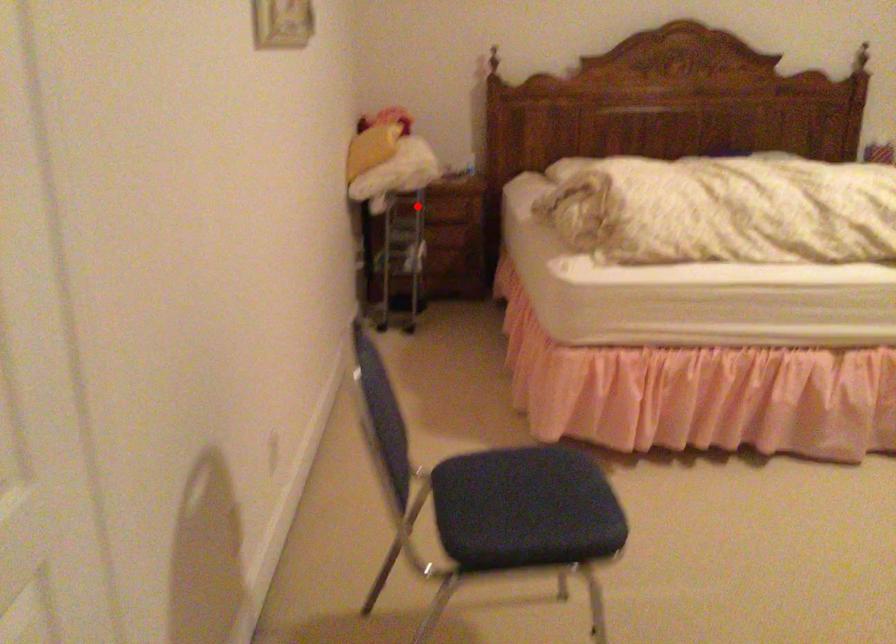
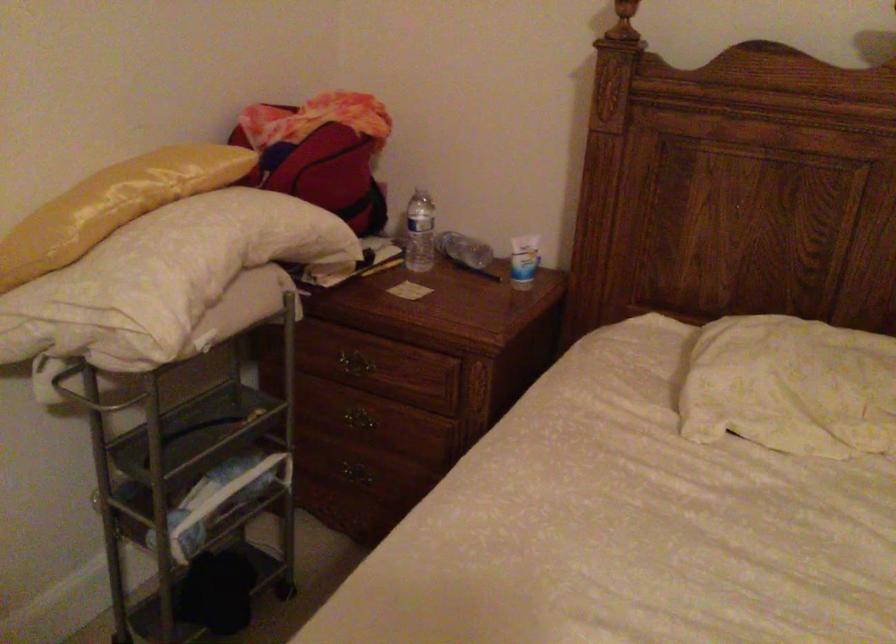
Question: I am providing you with two images of the same scene from different viewpoints. Given a red point in image1, look at the same physical point in image2. Is it:

Choices:
 (A) Closer to the viewpoint
 (B) Farther from the viewpoint

Answer: (A)